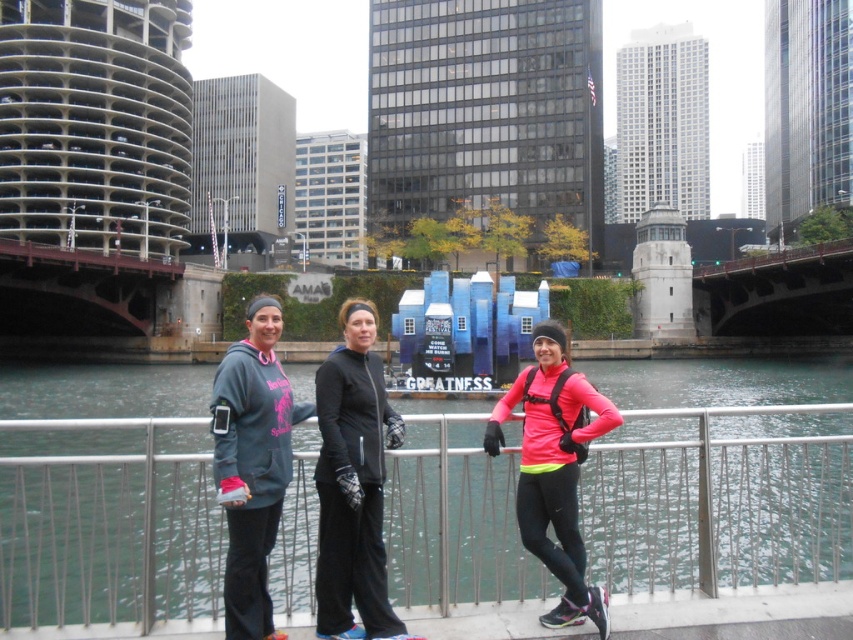
Question: Does pink matte jacket at center have a larger size compared to rusty metal bridge at left?

Choices:
 (A) yes
 (B) no

Answer: (B)

Question: Among these objects, which one is farthest from the camera?

Choices:
 (A) black matte jacket at center
 (B) rusty metal bridge at left
 (C) gray fleece sweatshirt at center

Answer: (B)

Question: Which point is closer to the camera?

Choices:
 (A) (838, 276)
 (B) (293, 410)
 (C) (556, 566)
 (D) (323, 515)

Answer: (C)

Question: Based on their relative distances, which object is farther from the gray fleece sweatshirt at center?

Choices:
 (A) pink matte jacket at center
 (B) concrete bridge at right

Answer: (B)

Question: Considering the relative positions of silver metallic railing at center and concrete bridge at right in the image provided, where is silver metallic railing at center located with respect to concrete bridge at right?

Choices:
 (A) left
 (B) right

Answer: (A)

Question: In this image, where is rusty metal bridge at left located relative to concrete bridge at right?

Choices:
 (A) left
 (B) right

Answer: (A)